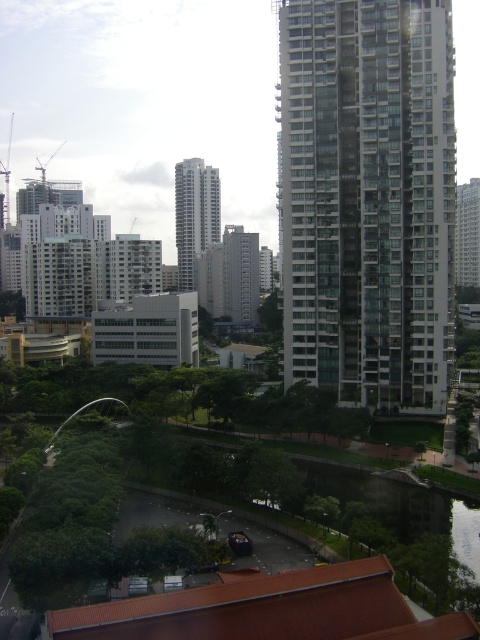
Is glassy white building at right bigger than white glassy tower at center?

Incorrect, glassy white building at right is not larger than white glassy tower at center.

Between glassy white building at right and white glassy tower at center, which one is positioned lower?

glassy white building at right

Locate an element on the screen. This screenshot has height=640, width=480. glassy white building at right is located at coordinates (368, 198).

Does glassy white building at right have a greater width compared to glassy reflective skyscraper at center?

In fact, glassy white building at right might be narrower than glassy reflective skyscraper at center.

Is point (340, 310) positioned in front of point (465, 248)?

Yes, it is in front of point (465, 248).

Who is more distant from viewer, [335,381] or [470,234]?

Positioned behind is point [470,234].

This screenshot has width=480, height=640. Identify the location of glassy white building at right. (368, 198).

Is white glassy tower at center smaller than glassy reflective skyscraper at center?

A: Indeed, white glassy tower at center has a smaller size compared to glassy reflective skyscraper at center.

Who is taller, white glassy tower at center or glassy reflective skyscraper at center?

With more height is white glassy tower at center.

The image size is (480, 640). In order to click on white glassy tower at center in this screenshot , I will do `click(194, 214)`.

Identify the location of white glassy tower at center. (194, 214).